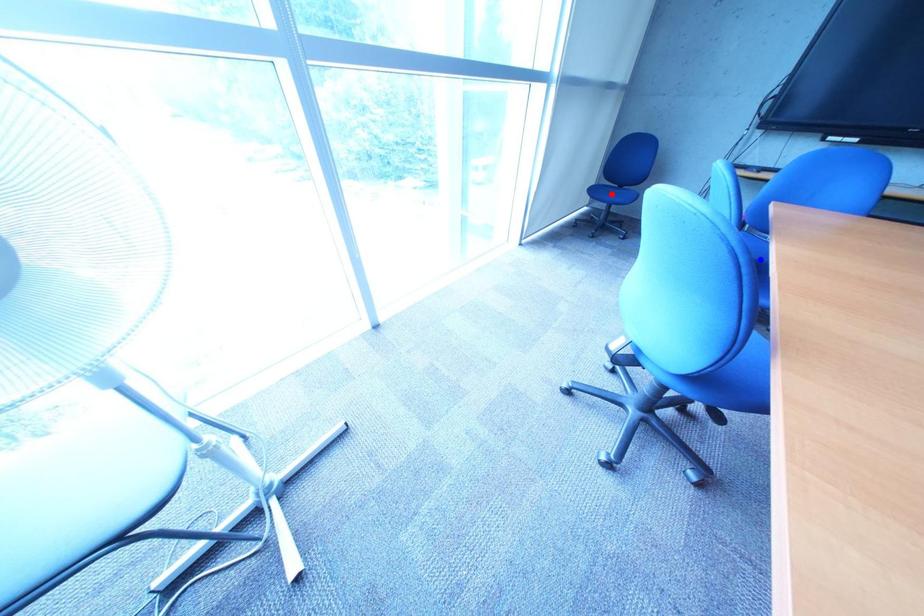
Question: In the image, two points are highlighted. Which point is nearer to the camera? Reply with the corresponding letter.

Choices:
 (A) blue point
 (B) red point

Answer: (A)